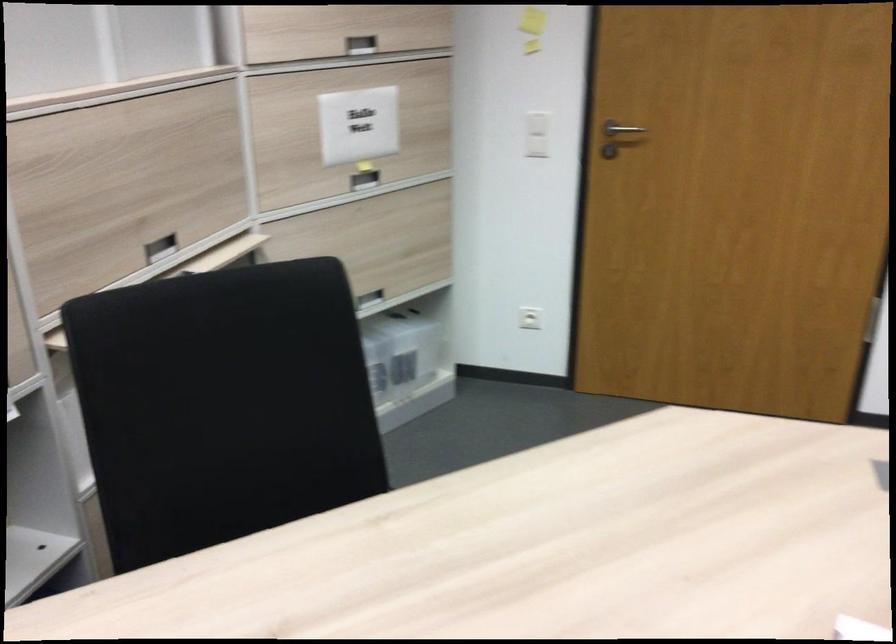
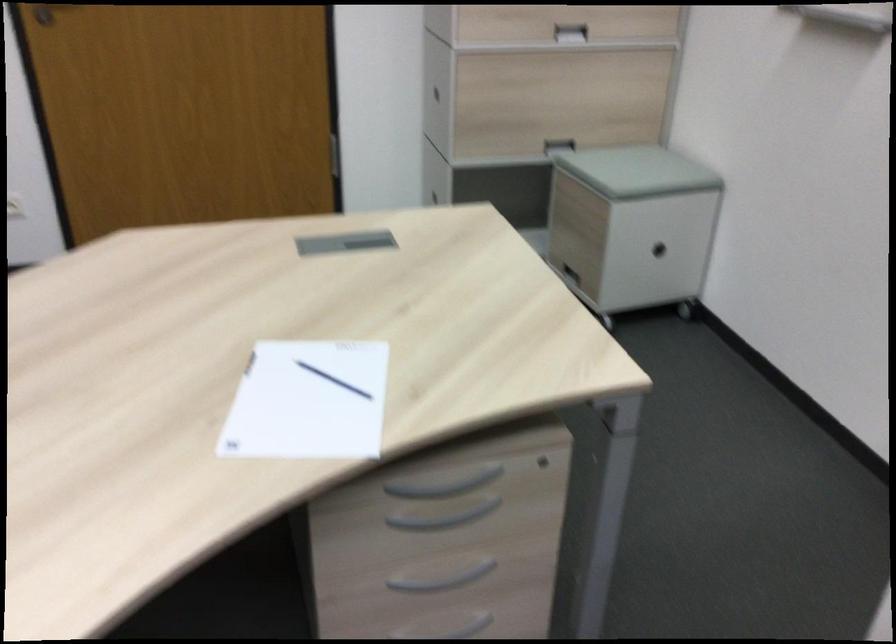
Question: The camera is either moving clockwise (left) or counter-clockwise (right) around the object. The first image is from the beginning of the video and the second image is from the end. Is the camera moving left or right when shooting the video?

Choices:
 (A) Left
 (B) Right

Answer: (A)